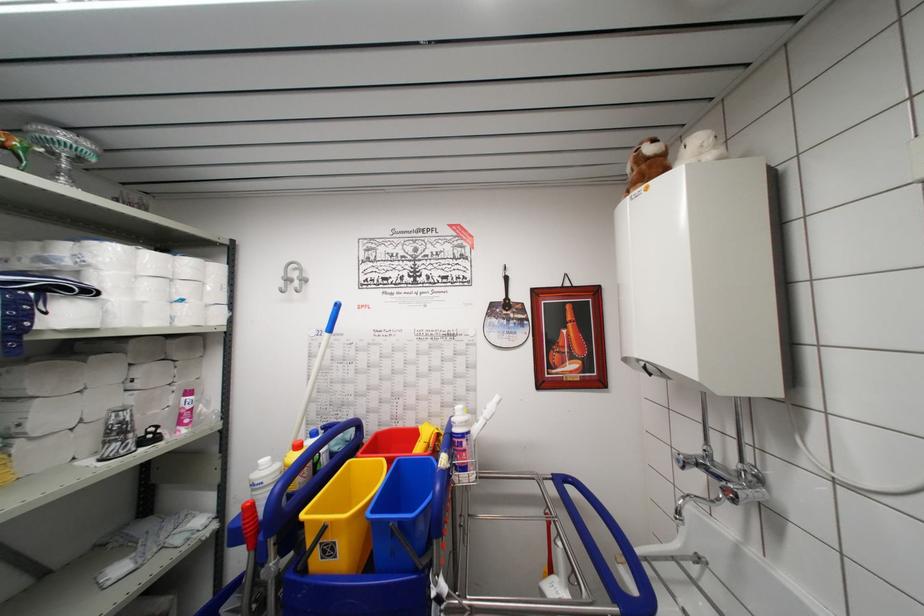
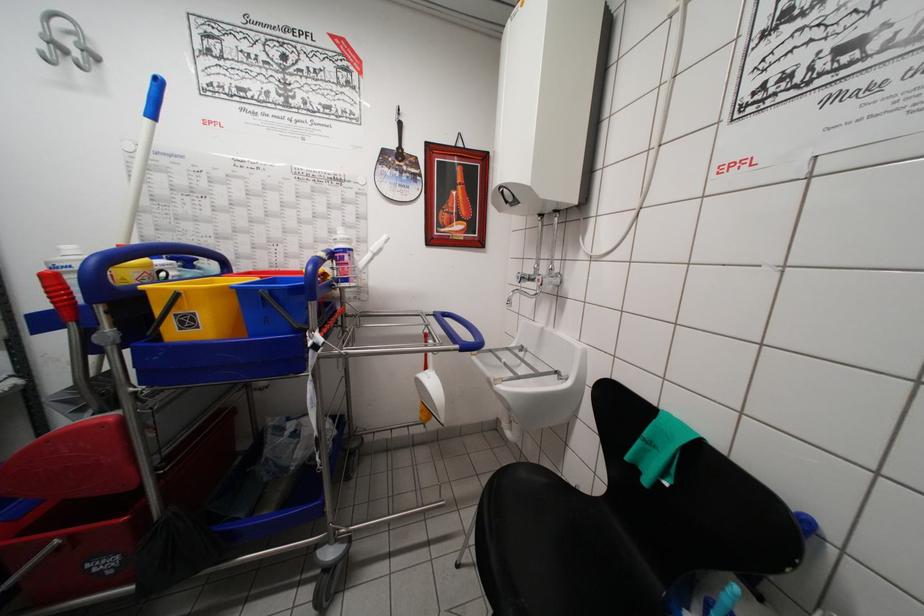
Find the pixel in the second image that matches pixel 258 517 in the first image.

(67, 289)